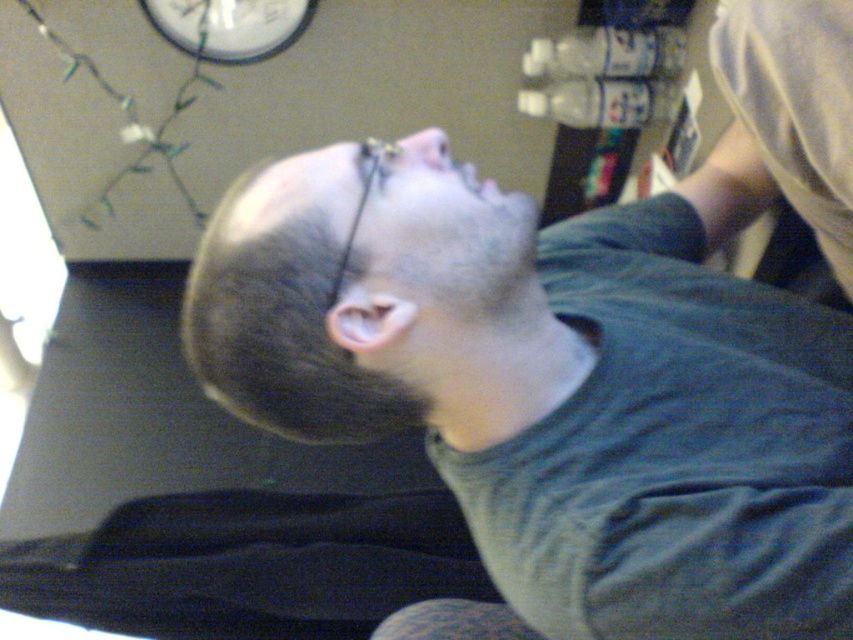
You are a home inspector checking the layout of this room. You notice the dark green fabric at upper center and the white plastic clock at upper center. Which object is positioned higher in the room?

The white plastic clock at upper center is positioned higher than the dark green fabric at upper center because the dark green fabric at upper center is below it.